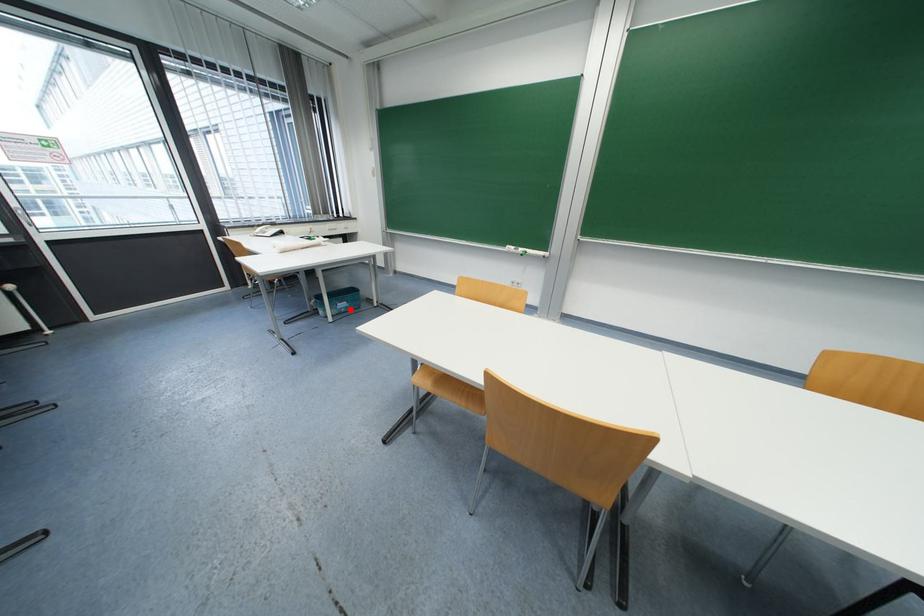
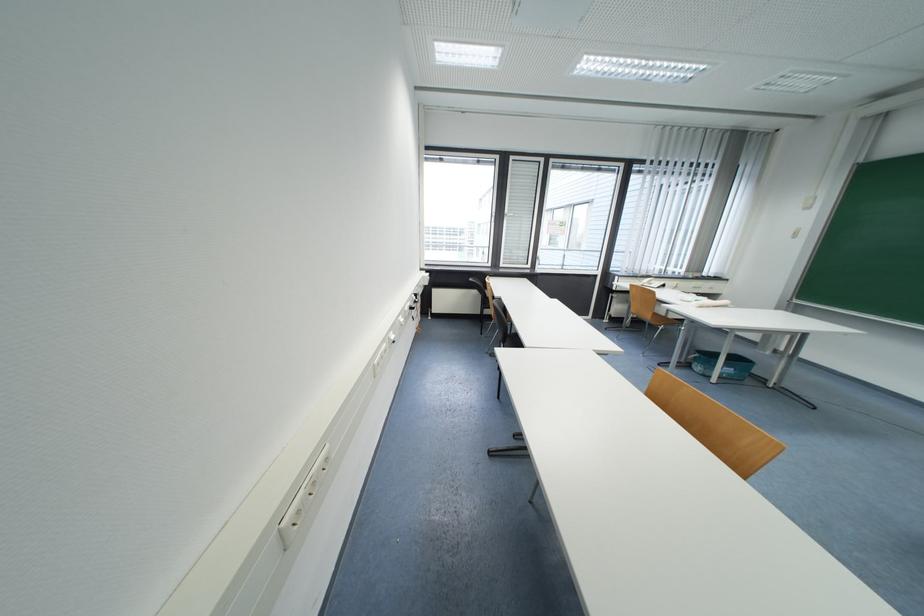
Question: I am providing you with two images of the same scene from different viewpoints. In image1, a red point is highlighted. Considering the same 3D point in image2, which of the following is correct?

Choices:
 (A) It is closer
 (B) It is farther

Answer: (B)